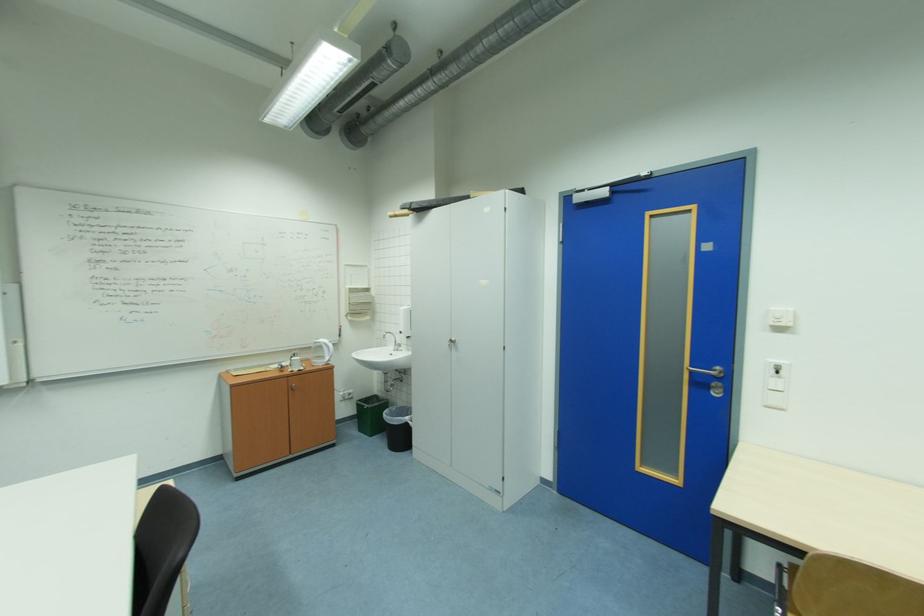
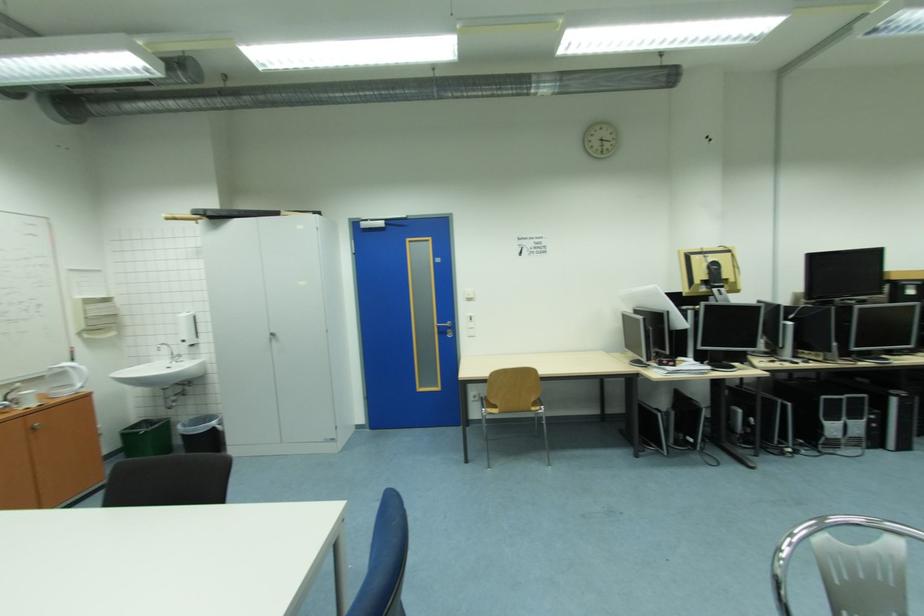
The point at (407, 333) is marked in the first image. Where is the corresponding point in the second image?

(189, 342)